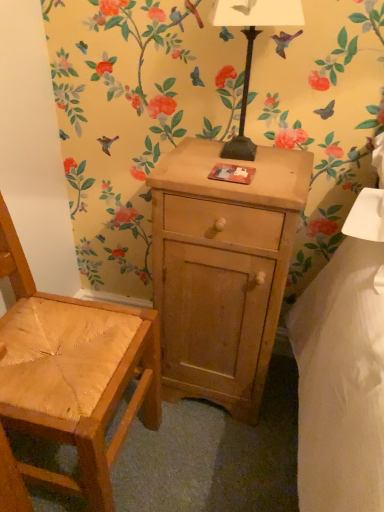
Question: Does natural wood chair at left appear on the left side of light brown wood cabinet at center?

Choices:
 (A) no
 (B) yes

Answer: (B)

Question: Considering the relative sizes of natural wood chair at left and light brown wood cabinet at center in the image provided, is natural wood chair at left thinner than light brown wood cabinet at center?

Choices:
 (A) no
 (B) yes

Answer: (A)

Question: Is the surface of natural wood chair at left in direct contact with light brown wood cabinet at center?

Choices:
 (A) no
 (B) yes

Answer: (A)

Question: Can you confirm if natural wood chair at left is bigger than light brown wood cabinet at center?

Choices:
 (A) yes
 (B) no

Answer: (A)

Question: Is natural wood chair at left positioned far away from light brown wood cabinet at center?

Choices:
 (A) yes
 (B) no

Answer: (B)

Question: In the image, is metallic black lamp at upper center positioned in front of or behind light brown wood cabinet at center?

Choices:
 (A) front
 (B) behind

Answer: (A)

Question: From a real-world perspective, is metallic black lamp at upper center positioned above or below light brown wood cabinet at center?

Choices:
 (A) below
 (B) above

Answer: (B)

Question: Which is correct: metallic black lamp at upper center is inside light brown wood cabinet at center, or outside of it?

Choices:
 (A) inside
 (B) outside

Answer: (B)

Question: Is metallic black lamp at upper center taller or shorter than light brown wood cabinet at center?

Choices:
 (A) tall
 (B) short

Answer: (B)

Question: In terms of height, does natural wood chair at left look taller or shorter compared to metallic black lamp at upper center?

Choices:
 (A) tall
 (B) short

Answer: (A)

Question: Is point (147, 393) closer or farther from the camera than point (231, 23)?

Choices:
 (A) farther
 (B) closer

Answer: (A)

Question: In the image, is natural wood chair at left positioned in front of or behind metallic black lamp at upper center?

Choices:
 (A) front
 (B) behind

Answer: (A)

Question: Is natural wood chair at left wider or thinner than metallic black lamp at upper center?

Choices:
 (A) wide
 (B) thin

Answer: (A)

Question: Considering the positions of light brown wood cabinet at center and metallic black lamp at upper center in the image, is light brown wood cabinet at center taller or shorter than metallic black lamp at upper center?

Choices:
 (A) tall
 (B) short

Answer: (A)

Question: In terms of width, does light brown wood cabinet at center look wider or thinner when compared to metallic black lamp at upper center?

Choices:
 (A) thin
 (B) wide

Answer: (B)